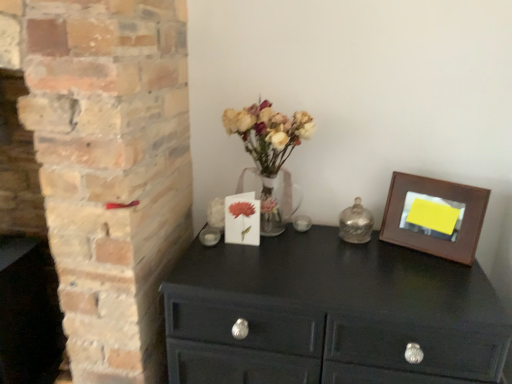
You are a GUI agent. You are given a task and a screenshot of the screen. Output one action in this format:
    pyautogui.click(x=<x>, y=<y>)
    Task: Click on the vacant area located to the right-hand side of translucent glass vase at center
    Image resolution: width=512 pixels, height=384 pixels.
    Given the screenshot: What is the action you would take?
    pyautogui.click(x=343, y=245)